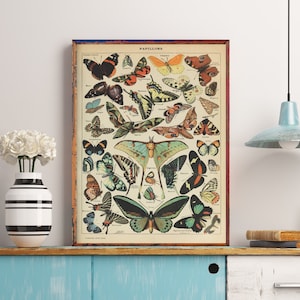
Identify the location of striped planter. (28, 212).